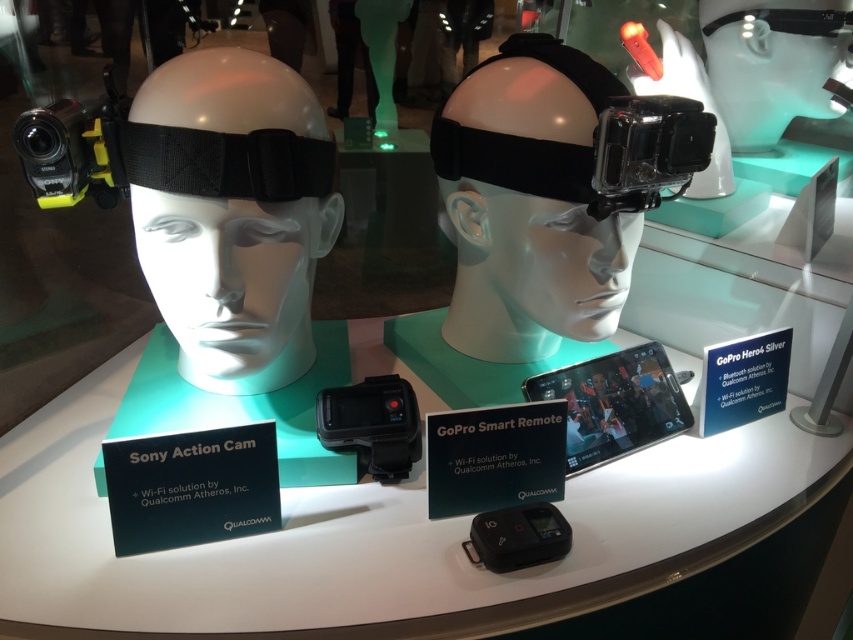
Is point (466, 243) behind point (280, 273)?

Yes, point (466, 243) is farther from viewer.

Identify the location of black matte gopro at center. This screenshot has height=640, width=853. (529, 204).

Can you confirm if white glossy table at center is positioned to the right of matte black headband at center?

Correct, you'll find white glossy table at center to the right of matte black headband at center.

Between white glossy table at center and matte black headband at center, which one has less height?

white glossy table at center is shorter.

Between point (260, 630) and point (206, 378), which one is positioned in front?

Point (260, 630) is in front.

Where is `white glossy table at center`? Image resolution: width=853 pixels, height=640 pixels. white glossy table at center is located at coordinates (376, 538).

Who is lower down, white glossy table at center or black matte gopro at center?

Positioned lower is white glossy table at center.

Is point (637, 465) closer to viewer compared to point (468, 100)?

No, (637, 465) is further to viewer.

This screenshot has width=853, height=640. In order to click on white glossy table at center in this screenshot , I will do `click(376, 538)`.